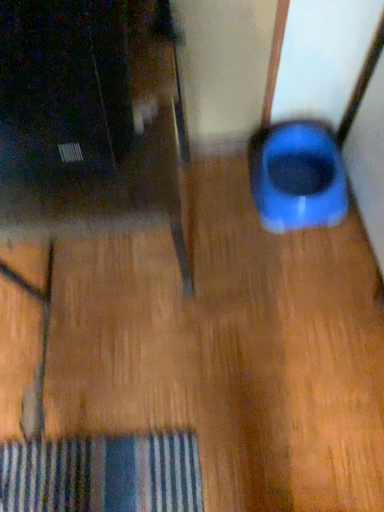
Measure the distance between point (308, 136) and camera.

Point (308, 136) is 1.16 meters from camera.

You are a GUI agent. You are given a task and a screenshot of the screen. Output one action in this format:
    pyautogui.click(x=<x>, y=<y>)
    Task: Click on the blue glossy toilet at lower right
    
    Given the screenshot: What is the action you would take?
    pyautogui.click(x=298, y=178)

The width and height of the screenshot is (384, 512). What do you see at coordinates (298, 178) in the screenshot?
I see `blue glossy toilet at lower right` at bounding box center [298, 178].

Find the location of a particular element. This screenshot has width=384, height=512. blue glossy toilet at lower right is located at coordinates tap(298, 178).